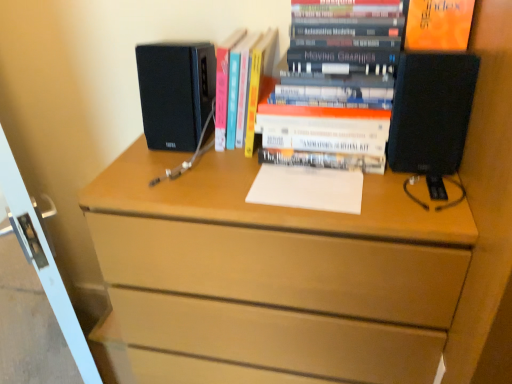
Question: Is there a large distance between orange matte paper at upper right and white glossy screen door at left?

Choices:
 (A) no
 (B) yes

Answer: (A)

Question: Does orange matte paper at upper right have a larger size compared to white glossy screen door at left?

Choices:
 (A) no
 (B) yes

Answer: (A)

Question: Is the depth of orange matte paper at upper right greater than that of white glossy screen door at left?

Choices:
 (A) yes
 (B) no

Answer: (A)

Question: Can you confirm if orange matte paper at upper right is thinner than white glossy screen door at left?

Choices:
 (A) yes
 (B) no

Answer: (A)

Question: Can you confirm if orange matte paper at upper right is positioned to the left of white glossy screen door at left?

Choices:
 (A) yes
 (B) no

Answer: (B)

Question: Does orange matte paper at upper right turn towards white glossy screen door at left?

Choices:
 (A) yes
 (B) no

Answer: (B)

Question: Is hardcover book at center, the 2th book positioned from the right, taller than white paper at center?

Choices:
 (A) yes
 (B) no

Answer: (A)

Question: Considering the relative sizes of hardcover book at center, the 2th book positioned from the right, and white paper at center in the image provided, is hardcover book at center, the 2th book positioned from the right, smaller than white paper at center?

Choices:
 (A) yes
 (B) no

Answer: (B)

Question: Is hardcover book at center, which appears as the first book when viewed from the left, outside of white paper at center?

Choices:
 (A) no
 (B) yes

Answer: (B)

Question: Is hardcover book at center, which appears as the first book when viewed from the left, facing towards white paper at center?

Choices:
 (A) no
 (B) yes

Answer: (A)

Question: Can you confirm if hardcover book at center, the 2th book positioned from the right, is positioned to the right of white paper at center?

Choices:
 (A) no
 (B) yes

Answer: (A)

Question: Is hardcover book at center, the 2th book positioned from the right, thinner than white paper at center?

Choices:
 (A) no
 (B) yes

Answer: (A)

Question: Is hardcover books at center, which appears as the 2th book when viewed from the left, not close to orange matte paper at upper right?

Choices:
 (A) yes
 (B) no

Answer: (B)